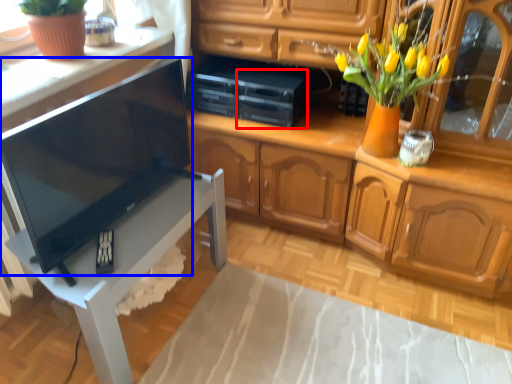
Question: Which point is closer to the camera, appliance (highlighted by a red box) or television (highlighted by a blue box)?

Choices:
 (A) appliance
 (B) television

Answer: (B)